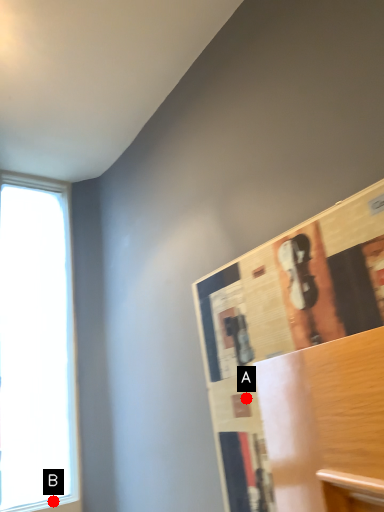
Question: Two points are circled on the image, labeled by A and B beside each circle. Among these points, which one is nearest to the camera?

Choices:
 (A) A is closer
 (B) B is closer

Answer: (A)